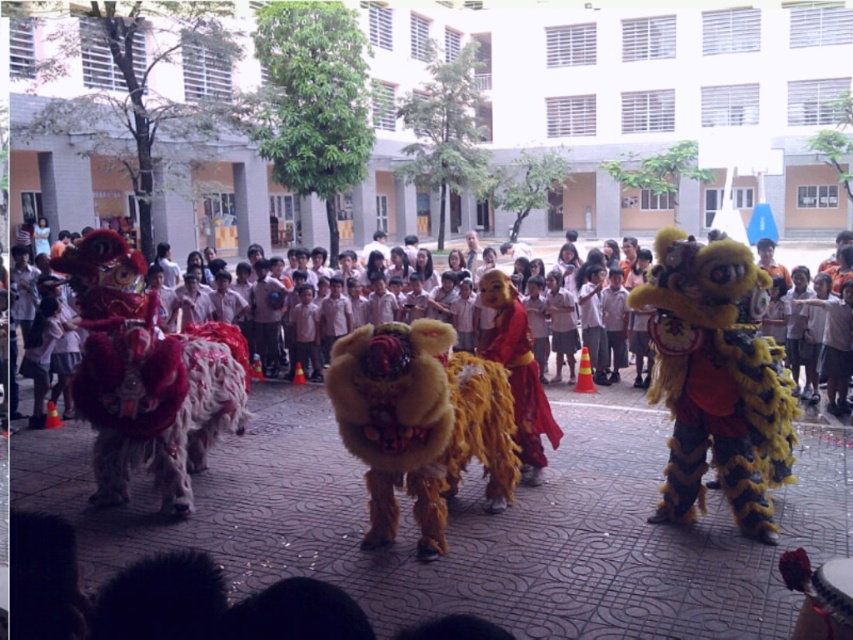
Is yellow furry lion at right shorter than shiny red fabric lion at center?

No, yellow furry lion at right is not shorter than shiny red fabric lion at center.

Which is below, yellow furry lion at right or shiny red fabric lion at center?

Positioned lower is shiny red fabric lion at center.

The width and height of the screenshot is (853, 640). I want to click on yellow furry lion at right, so click(x=717, y=380).

Is shiny red lion at left to the right of fuzzy yellow lion at center from the viewer's perspective?

Incorrect, shiny red lion at left is not on the right side of fuzzy yellow lion at center.

Is point (86, 237) behind point (451, 422)?

That is True.

This screenshot has width=853, height=640. I want to click on shiny red lion at left, so click(148, 378).

Who is positioned more to the left, yellow furry lion at right or shiny red lion at left?

From the viewer's perspective, shiny red lion at left appears more on the left side.

Is yellow furry lion at right closer to camera compared to shiny red lion at left?

Yes, yellow furry lion at right is closer to the viewer.

Where is `yellow furry lion at right`? This screenshot has height=640, width=853. yellow furry lion at right is located at coordinates (717, 380).

Where is `yellow furry lion at right`? The height and width of the screenshot is (640, 853). yellow furry lion at right is located at coordinates (717, 380).